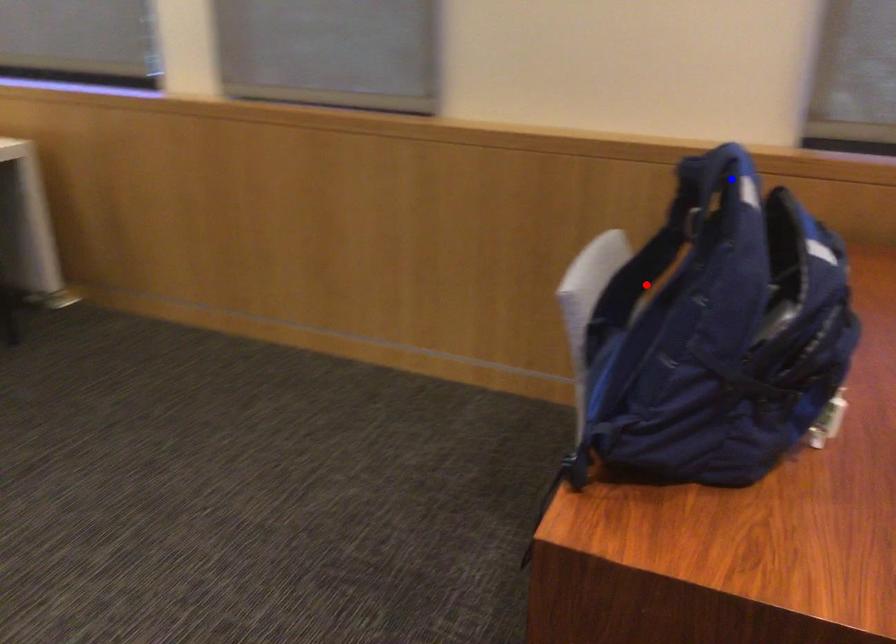
Question: Which of the two points in the image is closer to the camera?

Choices:
 (A) Blue point is closer.
 (B) Red point is closer.

Answer: (A)